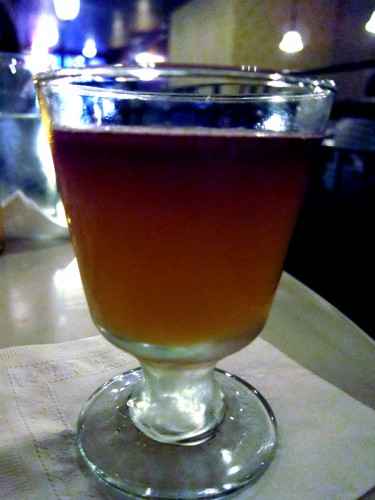
Identify the location of bar top. The height and width of the screenshot is (500, 375). click(35, 303), click(312, 348).